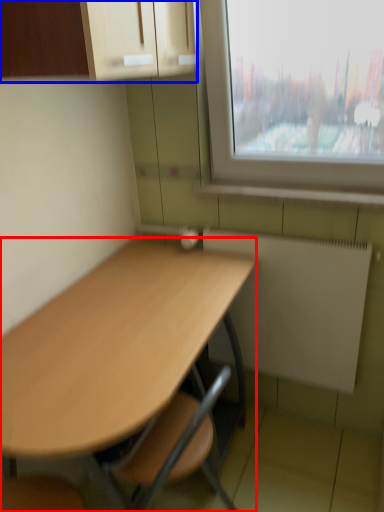
Question: Which point is closer to the camera, desk (highlighted by a red box) or cabinetry (highlighted by a blue box)?

Choices:
 (A) desk
 (B) cabinetry

Answer: (A)